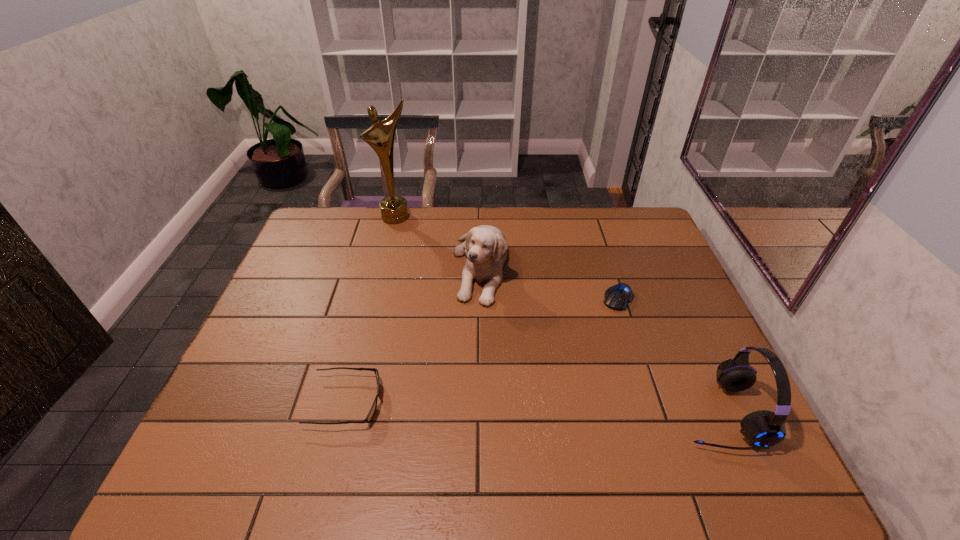
The width and height of the screenshot is (960, 540). What are the coordinates of `free space on the desktop that is between the sunglasses and the headset and is positioned on the front-facing side of the third object from left to right` in the screenshot? It's located at (483, 406).

In order to click on free spot on the desktop that is between the fourth tallest object and the headset and is positioned on the front-facing side of the tallest object in this screenshot , I will do `click(494, 406)`.

Locate an element on the screen. The height and width of the screenshot is (540, 960). vacant space on the desktop that is between the sunglasses and the headset and is positioned on the button side of the shortest object is located at coordinates (542, 408).